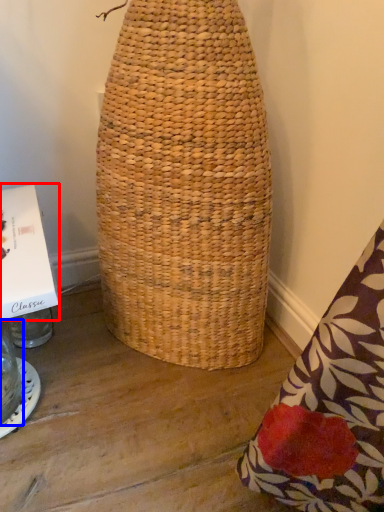
Question: Which object is closer to the camera taking this photo, cardboard box (highlighted by a red box) or glass jar (highlighted by a blue box)?

Choices:
 (A) cardboard box
 (B) glass jar

Answer: (A)